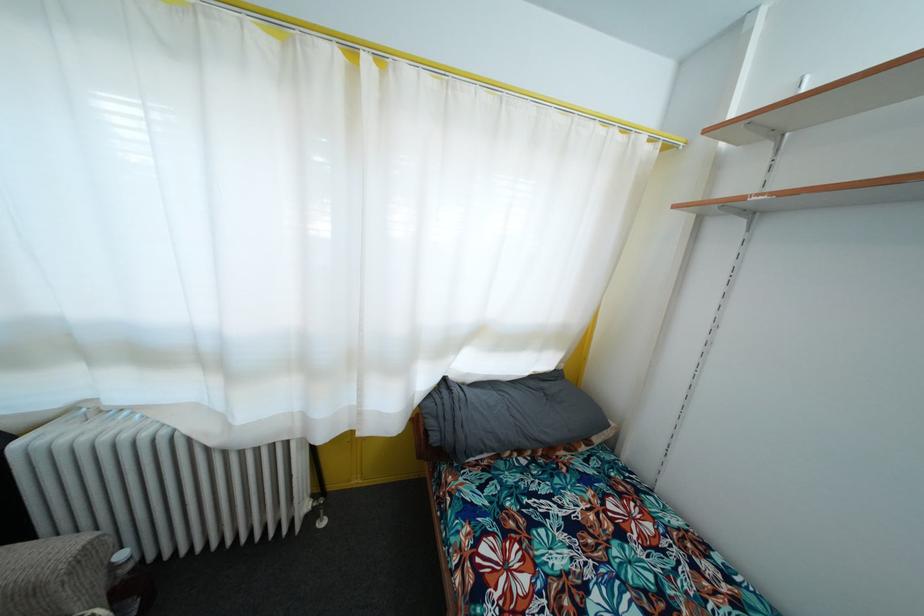
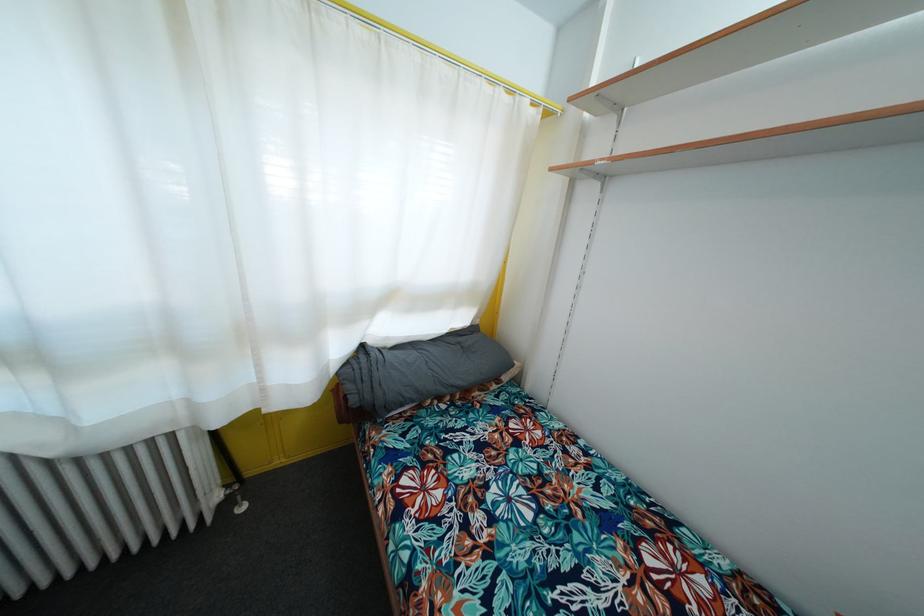
The point at (439,445) is marked in the first image. Where is the corresponding point in the second image?

(358, 407)